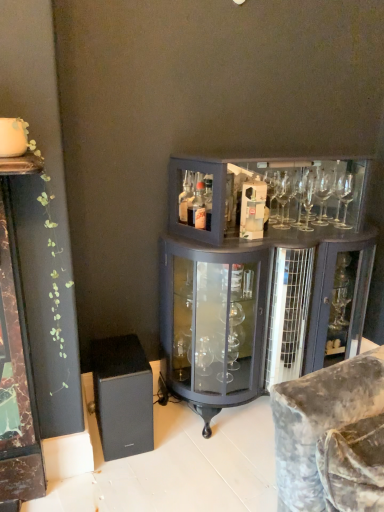
At what (x,y) coordinates should I click in order to perform the action: click on free space in front of black matte speaker at lower left. Please return your answer as a coordinate pair (x, y). Looking at the image, I should click on (125, 480).